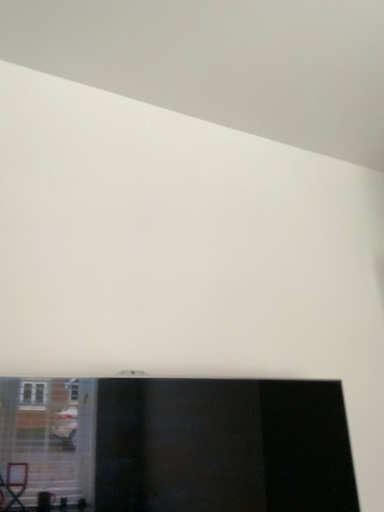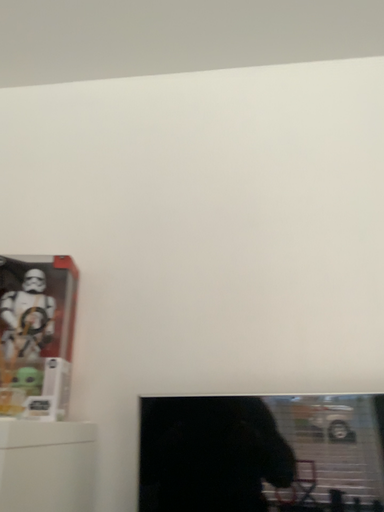
Question: Which way did the camera rotate in the video?

Choices:
 (A) rotated right
 (B) rotated left

Answer: (B)